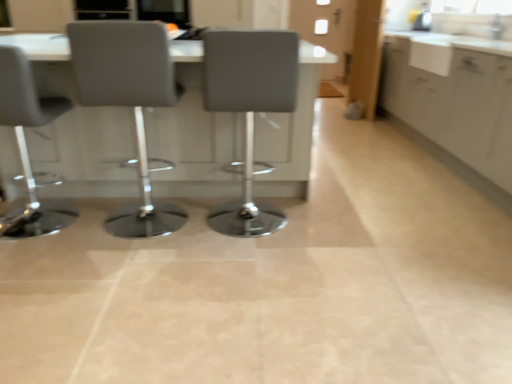
Question: Considering the relative sizes of white glossy table at center and white matte cabinet at right in the image provided, is white glossy table at center shorter than white matte cabinet at right?

Choices:
 (A) yes
 (B) no

Answer: (A)

Question: Considering the relative sizes of white glossy table at center and white matte cabinet at right in the image provided, is white glossy table at center bigger than white matte cabinet at right?

Choices:
 (A) no
 (B) yes

Answer: (B)

Question: Can you confirm if white glossy table at center is positioned to the left of white matte cabinet at right?

Choices:
 (A) yes
 (B) no

Answer: (A)

Question: From a real-world perspective, is white glossy table at center beneath white matte cabinet at right?

Choices:
 (A) yes
 (B) no

Answer: (A)

Question: Is white matte cabinet at right at the back of white glossy table at center?

Choices:
 (A) yes
 (B) no

Answer: (B)

Question: Is white glossy table at center thinner than white matte cabinet at right?

Choices:
 (A) yes
 (B) no

Answer: (B)

Question: Can you confirm if matte gray chair at left, the 1th chair viewed from the left, is taller than matte gray chair at center, positioned as the third chair in left-to-right order?

Choices:
 (A) no
 (B) yes

Answer: (A)

Question: Is matte gray chair at left, the 1th chair viewed from the left, to the right of matte gray chair at center, which ranks as the 1th chair in right-to-left order, from the viewer's perspective?

Choices:
 (A) yes
 (B) no

Answer: (B)

Question: Could you tell me if matte gray chair at left, the 1th chair viewed from the left, is turned towards matte gray chair at center, which ranks as the 1th chair in right-to-left order?

Choices:
 (A) no
 (B) yes

Answer: (A)

Question: Is matte gray chair at left, the 1th chair viewed from the left, behind matte gray chair at center, positioned as the third chair in left-to-right order?

Choices:
 (A) no
 (B) yes

Answer: (A)

Question: Is matte gray chair at left, the 1th chair viewed from the left, oriented away from matte gray chair at center, positioned as the third chair in left-to-right order?

Choices:
 (A) yes
 (B) no

Answer: (B)

Question: From a real-world perspective, is matte gray chair at left, the 1th chair viewed from the left, on top of matte gray chair at center, which ranks as the 1th chair in right-to-left order?

Choices:
 (A) yes
 (B) no

Answer: (B)

Question: Can you confirm if matte black screen at upper center is positioned to the left of white glossy countertop at upper right?

Choices:
 (A) no
 (B) yes

Answer: (B)